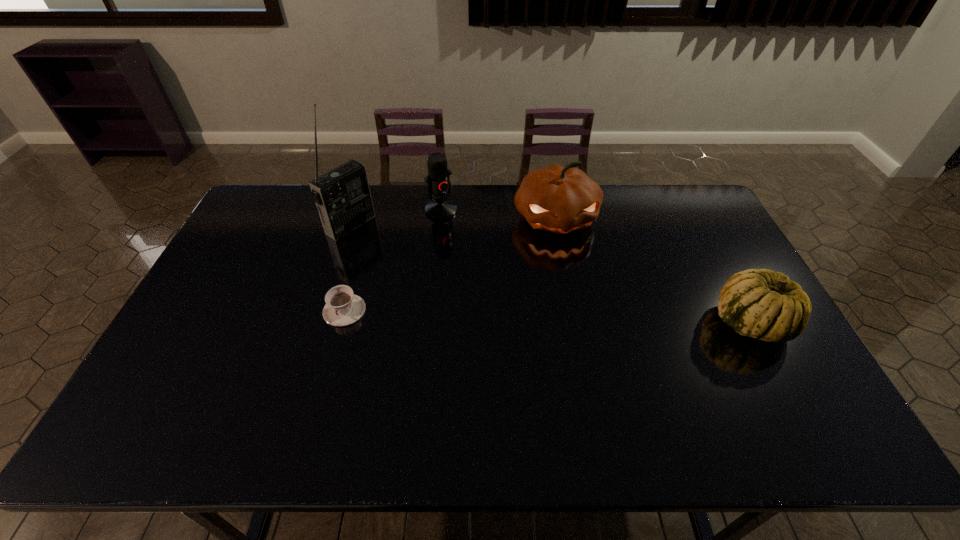
You are a GUI agent. You are given a task and a screenshot of the screen. Output one action in this format:
    pyautogui.click(x=<x>, y=<y>)
    Task: Click on the vacant region between the shortest object and the third object from left to right
    The height and width of the screenshot is (540, 960).
    Given the screenshot: What is the action you would take?
    pyautogui.click(x=393, y=260)

I want to click on free space between the radio receiver and the pumpkin, so click(x=453, y=221).

This screenshot has height=540, width=960. Find the location of `vacant space that is in between the pumpkin and the rightmost object`. vacant space that is in between the pumpkin and the rightmost object is located at coordinates (653, 271).

The image size is (960, 540). I want to click on free space that is in between the microphone and the tallest object, so click(396, 217).

Image resolution: width=960 pixels, height=540 pixels. Find the location of `free space between the second shortest object and the pumpkin`. free space between the second shortest object and the pumpkin is located at coordinates (653, 271).

Locate an element on the screen. This screenshot has width=960, height=540. free point between the gourd and the teacup is located at coordinates (547, 316).

At what (x,y) coordinates should I click in order to perform the action: click on free space that is in between the pumpkin and the shortest object. Please return your answer as a coordinate pair (x, y). The width and height of the screenshot is (960, 540). Looking at the image, I should click on (450, 265).

Find the location of `the third closest object relative to the radio receiver`. the third closest object relative to the radio receiver is located at coordinates (559, 199).

Identify the location of the second closest object relative to the second object from right to left. (758, 303).